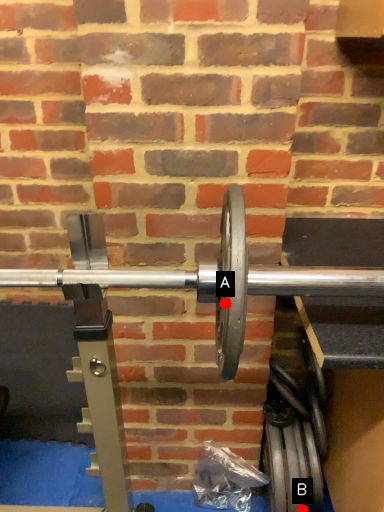
Question: Two points are circled on the image, labeled by A and B beside each circle. Among these points, which one is farthest from the camera?

Choices:
 (A) A is further
 (B) B is further

Answer: (B)